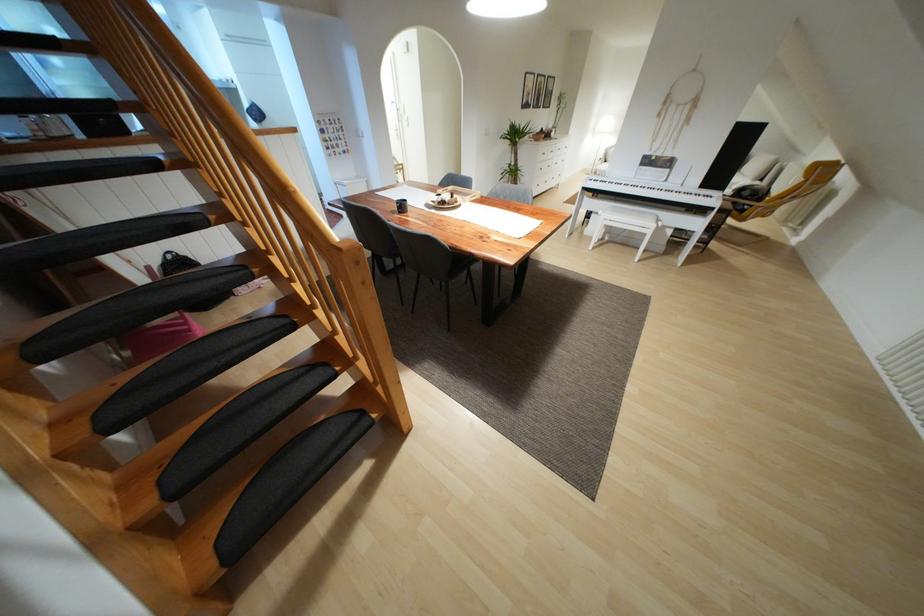
This screenshot has height=616, width=924. Identify the location of chair sitting surface. (629, 213).